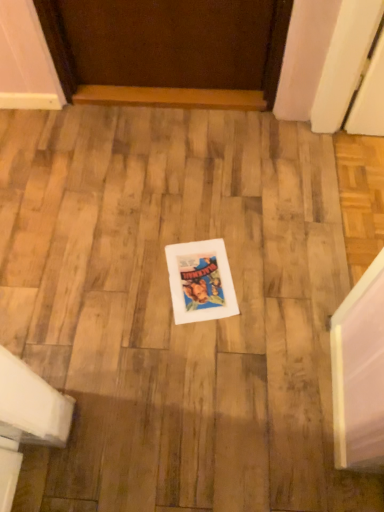
Where is `vacant area that is situated to the right of matte paper comic book at center`? This screenshot has height=512, width=384. vacant area that is situated to the right of matte paper comic book at center is located at coordinates (272, 277).